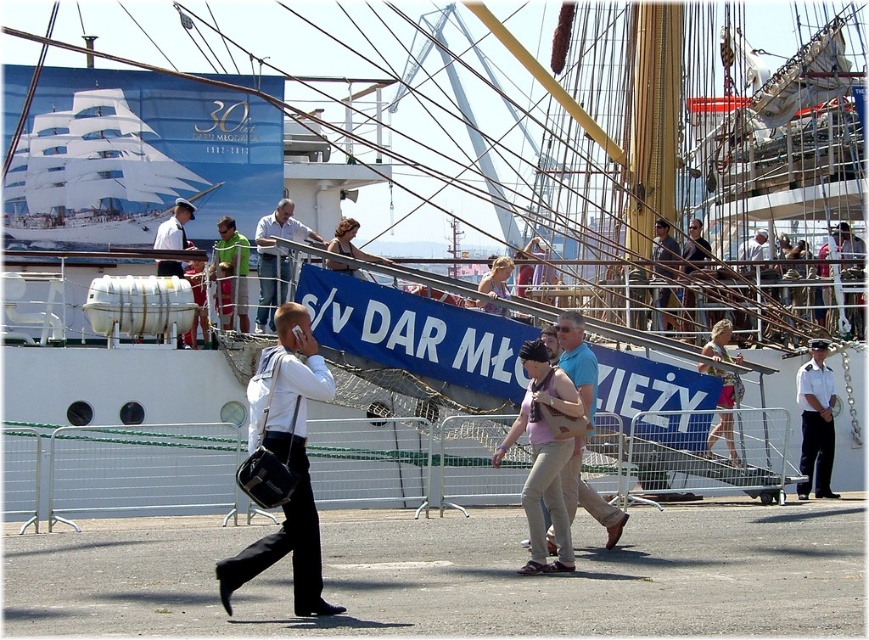
You are standing on the walkway and see the white leather bag at center and the white shirt at center. Which one is positioned more to the right?

The white leather bag at center is positioned to the right of the white shirt at center, so the white leather bag at center is more to the right.

From the picture: You are standing at the center of the walkway in the marina scene. There is a white leather bag at center. Where exactly is the white leather bag located in terms of coordinates?

The white leather bag at center is located at point coordinates of (284,460).

You are a photographer standing at the marina walkway. You need to capture a photo of both the white uniform at center and the green fabric shirt at center. Which subject should you focus on first to ensure both are in frame without moving the camera?

You should focus on the white uniform at center first because it is wider than the green fabric shirt at center, ensuring it fits within the frame before adjusting for the narrower subject.